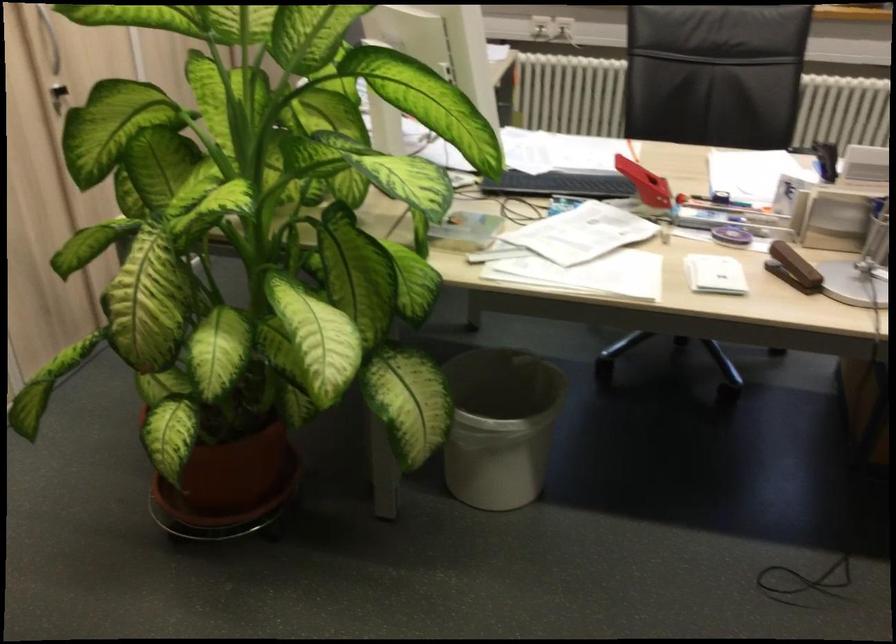
At what (x,y) coordinates should I click in order to perform the action: click on black chair sitting surface. Please return your answer as a coordinate pair (x, y). Image resolution: width=896 pixels, height=644 pixels. Looking at the image, I should click on (676, 158).